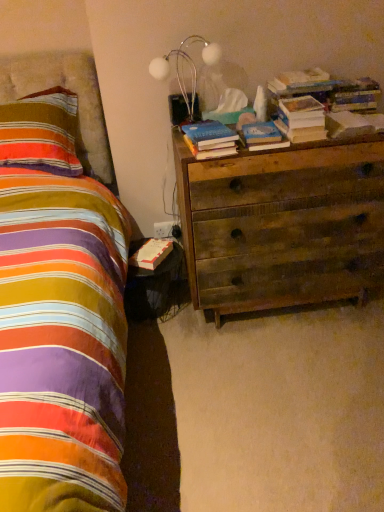
This screenshot has height=512, width=384. What do you see at coordinates (347, 125) in the screenshot?
I see `hardcover book at upper right, placed as the 3th paperback book when sorted from bottom to top` at bounding box center [347, 125].

Measure the distance between point [248,138] and camera.

Point [248,138] and camera are 1.58 meters apart from each other.

At what (x,y) coordinates should I click in order to perform the action: click on black glossy nightstand at lower left. Please return your answer as a coordinate pair (x, y). Looking at the image, I should click on click(154, 286).

Measure the distance between point (170, 276) and camera.

Point (170, 276) is 7.03 feet away from camera.

This screenshot has height=512, width=384. What do you see at coordinates (188, 66) in the screenshot? I see `white matte lamp at upper center` at bounding box center [188, 66].

Find the location of a particular element. The height and width of the screenshot is (512, 384). white matte lamp at upper center is located at coordinates (188, 66).

Where is `hardcover book at upper right, arranged as the 1th paperback book when viewed from the top`? Image resolution: width=384 pixels, height=512 pixels. hardcover book at upper right, arranged as the 1th paperback book when viewed from the top is located at coordinates (347, 125).

Which is more to the left, striped fabric pillow at left or wooden chest of drawers at right?

Positioned to the left is striped fabric pillow at left.

Between striped fabric pillow at left and wooden chest of drawers at right, which one has larger width?

Wider between the two is wooden chest of drawers at right.

Considering the positions of point (72, 150) and point (358, 201), is point (72, 150) closer or farther from the camera than point (358, 201)?

Point (72, 150) is positioned farther from the camera compared to point (358, 201).

From a real-world perspective, is striped fabric pillow at left physically located above or below wooden chest of drawers at right?

Clearly, from a real-world perspective, striped fabric pillow at left is above wooden chest of drawers at right.

Starting from the striped fabric pillow at left, which book is the 2nd one to the right? Please provide its 2D coordinates.

[(302, 119)]

Is striped fabric pillow at left facing towards hardcover book at upper right, which ranks as the first book in right-to-left order?

No, striped fabric pillow at left is not turned towards hardcover book at upper right, which ranks as the first book in right-to-left order.

Does striped fabric pillow at left lie behind hardcover book at upper right, the second book from the left?

Yes, striped fabric pillow at left is further from the camera.

Would you say striped fabric pillow at left is to the left or to the right of hardcover book at upper right, which ranks as the first book in right-to-left order, in the picture?

From the image, it's evident that striped fabric pillow at left is to the left of hardcover book at upper right, which ranks as the first book in right-to-left order.

From a real-world perspective, which is physically below, hardcover book at bedside, the third paperback book positioned from the front, or white matte lamp at upper center?

hardcover book at bedside, the third paperback book positioned from the front.

Which is behind, point (150, 258) or point (205, 54)?

The point (150, 258) is behind.

Looking at their sizes, would you say hardcover book at bedside, the 3th paperback book positioned from the top, is wider or thinner than white matte lamp at upper center?

hardcover book at bedside, the 3th paperback book positioned from the top, is wider than white matte lamp at upper center.

Is hardcover book at bedside, the 1th paperback book in the bottom-to-top sequence, aimed at white matte lamp at upper center?

No, hardcover book at bedside, the 1th paperback book in the bottom-to-top sequence, is not oriented towards white matte lamp at upper center.

In terms of size, does hardcover book at upper right, placed as the 3th paperback book when sorted from bottom to top, appear bigger or smaller than hardcover book at upper right, which ranks as the first book in right-to-left order?

Considering their sizes, hardcover book at upper right, placed as the 3th paperback book when sorted from bottom to top, takes up less space than hardcover book at upper right, which ranks as the first book in right-to-left order.

Does hardcover book at upper right, placed as the 3th paperback book when sorted from bottom to top, appear on the left side of hardcover book at upper right, which ranks as the first book in right-to-left order?

Incorrect, hardcover book at upper right, placed as the 3th paperback book when sorted from bottom to top, is not on the left side of hardcover book at upper right, which ranks as the first book in right-to-left order.

What's the angular difference between hardcover book at upper right, which ranks as the second paperback book in back-to-front order, and hardcover book at upper right, which ranks as the first book in right-to-left order,'s facing directions?

hardcover book at upper right, which ranks as the second paperback book in back-to-front order, and hardcover book at upper right, which ranks as the first book in right-to-left order, are facing 0.00116 degrees away from each other.

Is hardcover book at upper right, which is the 2th paperback book in front-to-back order, not inside hardcover book at upper right, which ranks as the first book in right-to-left order?

That's correct, hardcover book at upper right, which is the 2th paperback book in front-to-back order, is outside of hardcover book at upper right, which ranks as the first book in right-to-left order.

Which object is wider, wooden chest of drawers at right or hardcover book at upper right, the first paperback book from the right?

wooden chest of drawers at right is wider.

Is wooden chest of drawers at right positioned with its back to hardcover book at upper right, which ranks as the second paperback book in back-to-front order?

That's not correct — wooden chest of drawers at right is not looking away from hardcover book at upper right, which ranks as the second paperback book in back-to-front order.

Can you confirm if wooden chest of drawers at right is shorter than hardcover book at upper right, which is the 2th paperback book in front-to-back order?

No, wooden chest of drawers at right is not shorter than hardcover book at upper right, which is the 2th paperback book in front-to-back order.

Considering the relative sizes of wooden chest of drawers at right and hardcover book at upper right, the first paperback book from the right, in the image provided, is wooden chest of drawers at right smaller than hardcover book at upper right, the first paperback book from the right,?

No.

Considering the positions of objects black glossy nightstand at lower left and hardcover book at bedside, which appears as the first paperback book when viewed from the left, in the image provided, who is more to the left, black glossy nightstand at lower left or hardcover book at bedside, which appears as the first paperback book when viewed from the left,?

Positioned to the left is hardcover book at bedside, which appears as the first paperback book when viewed from the left.

Is black glossy nightstand at lower left situated inside hardcover book at bedside, the 3th paperback book positioned from the top, or outside?

black glossy nightstand at lower left is not enclosed by hardcover book at bedside, the 3th paperback book positioned from the top.

Is black glossy nightstand at lower left directly adjacent to hardcover book at bedside, the 3th paperback book positioned from the top?

No, black glossy nightstand at lower left is not next to hardcover book at bedside, the 3th paperback book positioned from the top.

Does point (317, 106) lie behind point (253, 138)?

No, (317, 106) is closer to viewer.

From a real-world perspective, which is physically below, hardcover book at upper right, which ranks as the first book in right-to-left order, or hardcover book at center, arranged as the 2th paperback book when viewed from the right?

hardcover book at center, arranged as the 2th paperback book when viewed from the right, is physically lower.

From the image's perspective, which object appears higher, hardcover book at upper right, which ranks as the first book in right-to-left order, or hardcover book at center, acting as the second paperback book starting from the bottom?

hardcover book at upper right, which ranks as the first book in right-to-left order, is shown above in the image.

Which object is thinner, hardcover book at upper right, which ranks as the first book in right-to-left order, or hardcover book at center, arranged as the 2th paperback book when viewed from the right?

hardcover book at center, arranged as the 2th paperback book when viewed from the right, is thinner.

The width and height of the screenshot is (384, 512). Find the location of `pillow located behind the wooden chest of drawers at right`. pillow located behind the wooden chest of drawers at right is located at coordinates (41, 133).

You are a GUI agent. You are given a task and a screenshot of the screen. Output one action in this format:
    pyautogui.click(x=<x>, y=<y>)
    Task: Click on the pillow located on the left of hardcover book at upper right, the second book from the left
    
    Given the screenshot: What is the action you would take?
    pyautogui.click(x=41, y=133)

Considering their positions, is hardcover book at upper right, the second book from the left, positioned further to striped fabric pillow at left than black glossy nightstand at lower left?

hardcover book at upper right, the second book from the left, lies further to striped fabric pillow at left than the other object.

Considering their positions, is hardcover book at center, which is the 1th book in left-to-right order, positioned further to black glossy nightstand at lower left than hardcover book at center, acting as the second paperback book starting from the bottom?

hardcover book at center, acting as the second paperback book starting from the bottom, is positioned further to the anchor black glossy nightstand at lower left.

Considering their positions, is hardcover book at center, which is the third paperback book from back to front, positioned further to hardcover book at center, marked as the 2th book in a right-to-left arrangement, than wooden chest of drawers at right?

wooden chest of drawers at right is positioned further to the anchor hardcover book at center, marked as the 2th book in a right-to-left arrangement.

Considering their positions, is striped fabric pillow at left positioned further to hardcover book at center, arranged as the 2th paperback book when viewed from the right, than hardcover book at center, marked as the 2th book in a right-to-left arrangement?

Based on the image, striped fabric pillow at left appears to be further to hardcover book at center, arranged as the 2th paperback book when viewed from the right.

Based on their spatial positions, is hardcover book at center, which is the third paperback book from back to front, or hardcover book at center, which is the 1th book in left-to-right order, further from black glossy nightstand at lower left?

hardcover book at center, which is the third paperback book from back to front, lies further to black glossy nightstand at lower left than the other object.

Considering their positions, is hardcover book at bedside, which appears as the first paperback book when viewed from the left, positioned closer to black glossy nightstand at lower left than hardcover book at upper right, which ranks as the first book in right-to-left order?

hardcover book at bedside, which appears as the first paperback book when viewed from the left, is closer to black glossy nightstand at lower left.

When comparing their distances from wooden chest of drawers at right, does striped fabric pillow at left or hardcover book at upper right, which is the 2th paperback book in front-to-back order, seem closer?

The object closer to wooden chest of drawers at right is hardcover book at upper right, which is the 2th paperback book in front-to-back order.

Which object lies nearer to the anchor point hardcover book at center, which is the 1th book in left-to-right order, black glossy nightstand at lower left or hardcover book at upper right, which ranks as the first book in right-to-left order?

The object closer to hardcover book at center, which is the 1th book in left-to-right order, is hardcover book at upper right, which ranks as the first book in right-to-left order.

The width and height of the screenshot is (384, 512). Find the location of `nightstand between striped fabric pillow at left and hardcover book at upper right, which ranks as the second paperback book in back-to-front order, from left to right`. nightstand between striped fabric pillow at left and hardcover book at upper right, which ranks as the second paperback book in back-to-front order, from left to right is located at coordinates (154, 286).

Find the location of a particular element. The image size is (384, 512). lamp between striped fabric pillow at left and hardcover book at upper right, the second book from the left, from left to right is located at coordinates (188, 66).

Where is `the chest of drawers located between striped fabric pillow at left and hardcover book at upper right, the second book from the left, in the left-right direction`? the chest of drawers located between striped fabric pillow at left and hardcover book at upper right, the second book from the left, in the left-right direction is located at coordinates (282, 225).

Find the location of a particular element. The height and width of the screenshot is (512, 384). book between hardcover book at center, acting as the second paperback book starting from the bottom, and wooden chest of drawers at right, in the vertical direction is located at coordinates (210, 140).